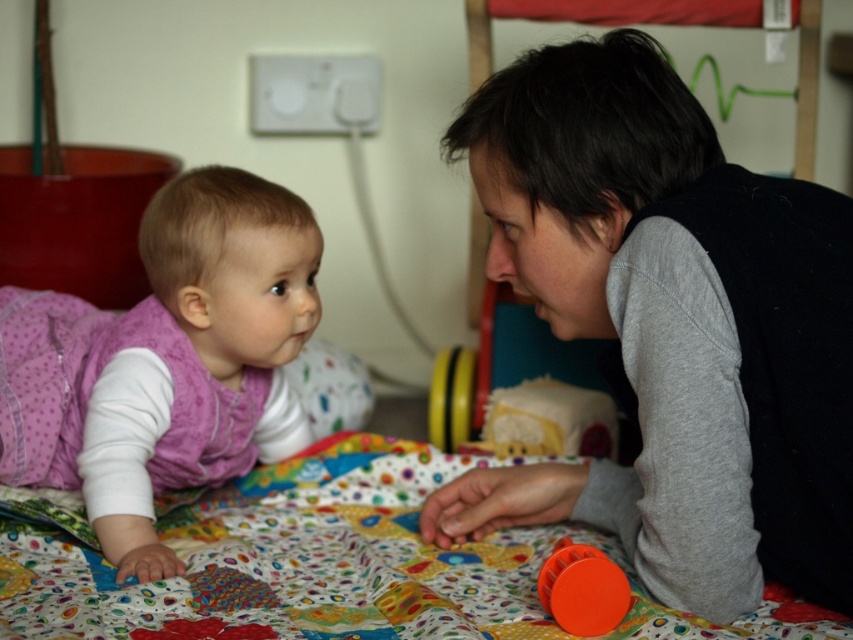
Does gray cotton shirt at upper right have a greater height compared to pink fabric toddler at lower left?

Yes, gray cotton shirt at upper right is taller than pink fabric toddler at lower left.

Which is more to the right, gray cotton shirt at upper right or pink fabric toddler at lower left?

gray cotton shirt at upper right

What do you see at coordinates (672, 324) in the screenshot? I see `gray cotton shirt at upper right` at bounding box center [672, 324].

Where is `gray cotton shirt at upper right`? This screenshot has width=853, height=640. gray cotton shirt at upper right is located at coordinates (672, 324).

Is polka dot fabric quilt at center smaller than pink fabric toddler at lower left?

Yes, polka dot fabric quilt at center is smaller than pink fabric toddler at lower left.

Image resolution: width=853 pixels, height=640 pixels. In order to click on polka dot fabric quilt at center in this screenshot , I will do `click(326, 564)`.

At what (x,y) coordinates should I click in order to perform the action: click on polka dot fabric quilt at center. Please return your answer as a coordinate pair (x, y). The width and height of the screenshot is (853, 640). Looking at the image, I should click on (326, 564).

Which is above, pink fabric toddler at lower left or orange matte toy at lower center?

pink fabric toddler at lower left

Can you confirm if pink fabric toddler at lower left is positioned to the left of orange matte toy at lower center?

Indeed, pink fabric toddler at lower left is positioned on the left side of orange matte toy at lower center.

Is point (294, 355) closer to viewer compared to point (570, 557)?

No, it is not.

The width and height of the screenshot is (853, 640). Find the location of `pink fabric toddler at lower left`. pink fabric toddler at lower left is located at coordinates (190, 358).